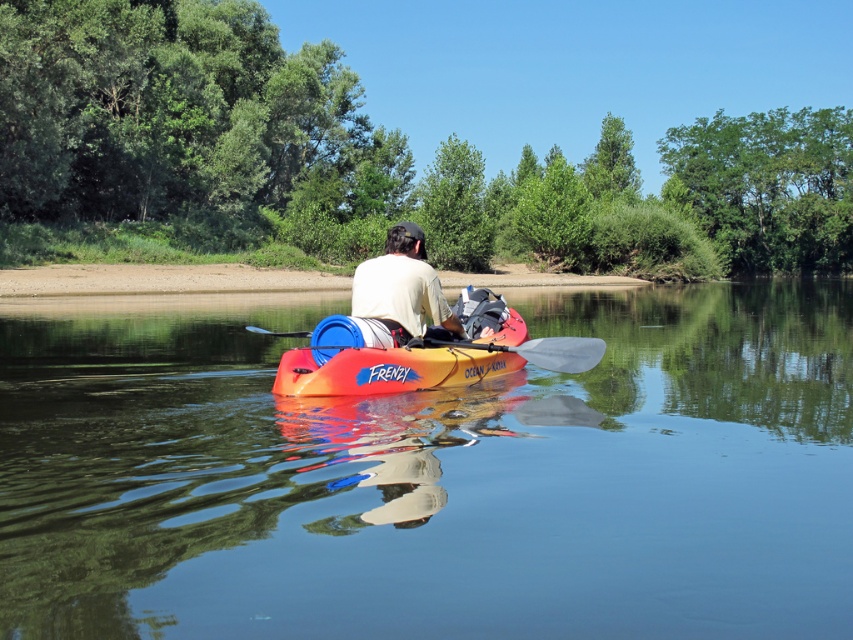
Question: Does transparent plastic kayak at center appear under matte white shirt at center?

Choices:
 (A) no
 (B) yes

Answer: (B)

Question: Which point is farther from the camera taking this photo?

Choices:
 (A) (381, 317)
 (B) (370, 625)
 (C) (523, 352)

Answer: (C)

Question: Among these points, which one is farthest from the camera?

Choices:
 (A) (686, 317)
 (B) (424, 323)
 (C) (263, 330)

Answer: (A)

Question: Can you confirm if transparent plastic kayak at center is positioned to the right of translucent plastic paddle at center?

Choices:
 (A) yes
 (B) no

Answer: (A)

Question: Estimate the real-world distances between objects in this image. Which object is farther from the matte white shirt at center?

Choices:
 (A) white plastic paddle at center
 (B) translucent plastic paddle at center

Answer: (B)

Question: Does matte white shirt at center appear under translucent plastic paddle at center?

Choices:
 (A) yes
 (B) no

Answer: (B)